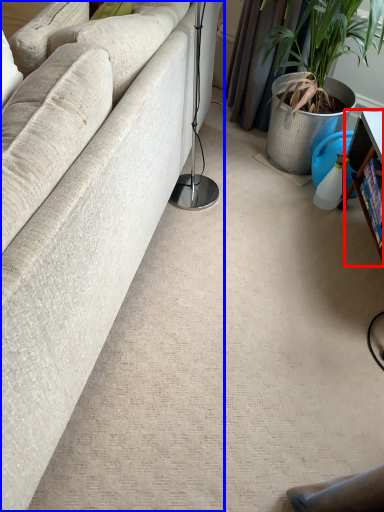
Question: Which object appears farthest to the camera in this image, table (highlighted by a red box) or studio couch (highlighted by a blue box)?

Choices:
 (A) table
 (B) studio couch

Answer: (A)